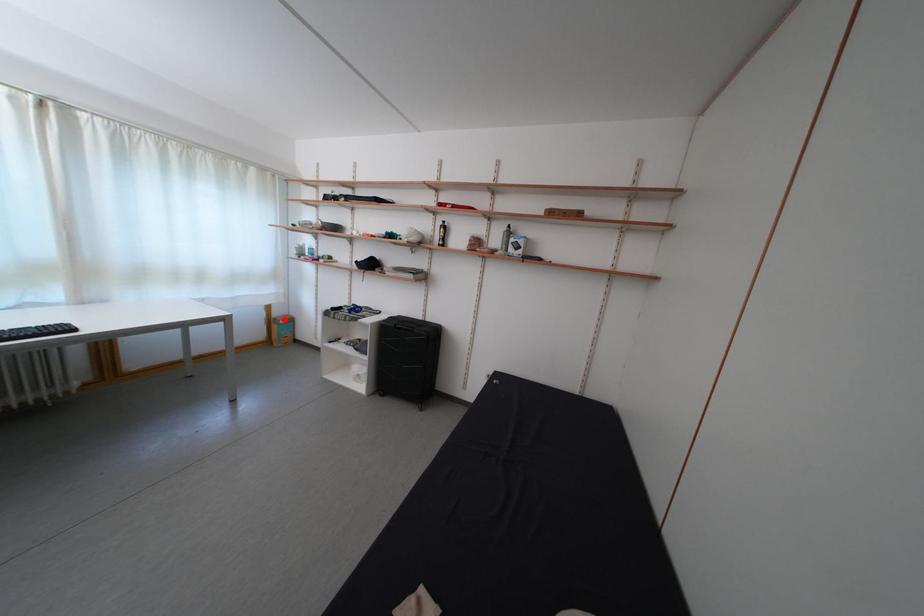
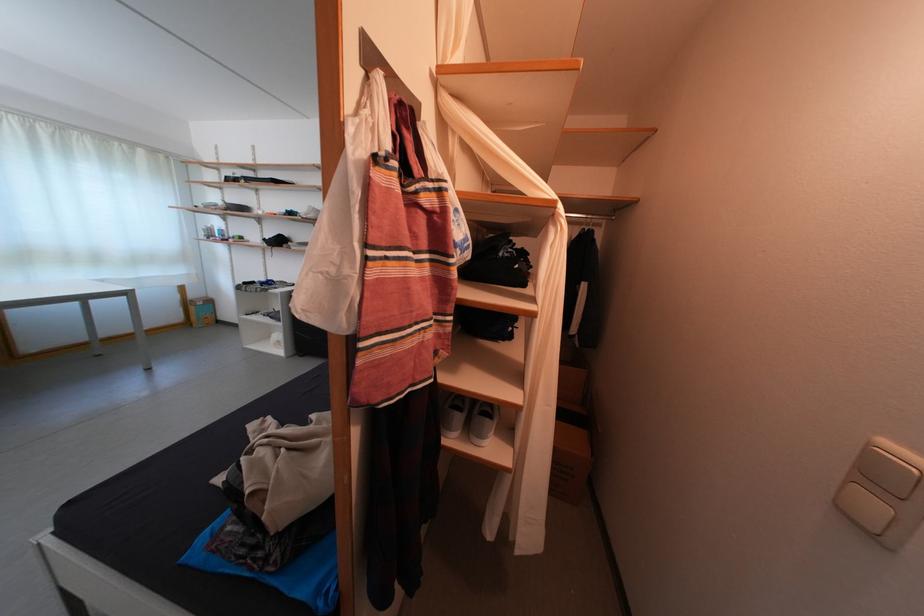
Question: I am providing you with two images of the same scene from different viewpoints. Image1 has a red point marked. In image2, the corresponding 3D location appears at what relative position? Reply with the corresponding letter.

Choices:
 (A) Closer
 (B) Farther

Answer: (A)